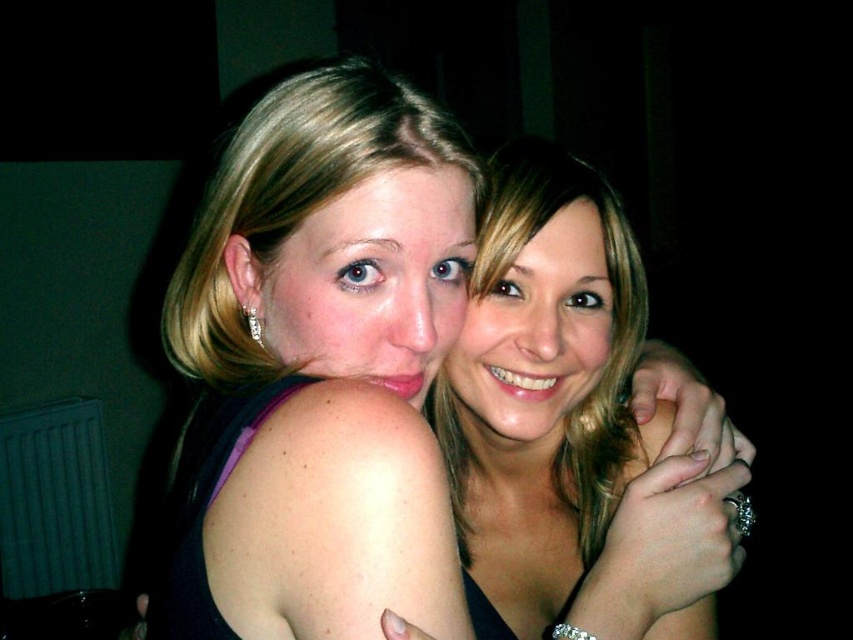
Which of these two, matte black dress at center or smooth skin face at center, stands taller?

matte black dress at center is taller.

Is matte black dress at center below smooth skin face at center?

Incorrect, matte black dress at center is not positioned below smooth skin face at center.

You are a GUI agent. You are given a task and a screenshot of the screen. Output one action in this format:
    pyautogui.click(x=<x>, y=<y>)
    Task: Click on the matte black dress at center
    
    Given the screenshot: What is the action you would take?
    pyautogui.click(x=318, y=371)